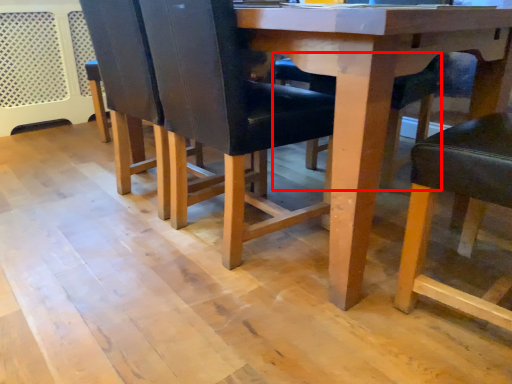
Question: Observing the image, what is the correct spatial positioning of chair (annotated by the red box) in reference to chair?

Choices:
 (A) right
 (B) left

Answer: (B)